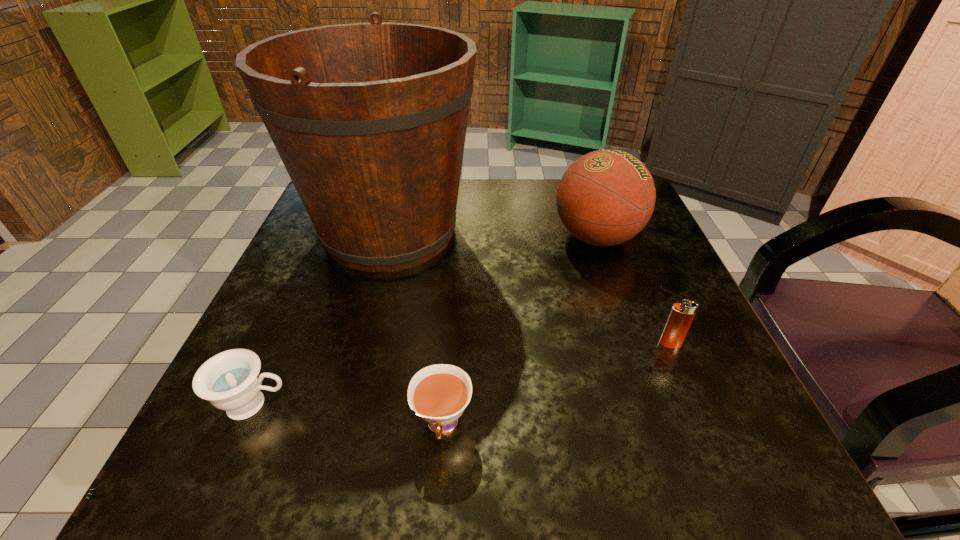
The image size is (960, 540). I want to click on the tallest object, so click(x=369, y=119).

Where is `basketball`? basketball is located at coordinates (606, 197).

The width and height of the screenshot is (960, 540). I want to click on igniter, so click(682, 314).

Find the location of a particular element. The image size is (960, 540). the third shortest object is located at coordinates (682, 314).

This screenshot has height=540, width=960. What are the coordinates of `the left teacup` in the screenshot? It's located at click(231, 381).

Locate an element on the screen. The width and height of the screenshot is (960, 540). the right teacup is located at coordinates (439, 393).

Find the location of a particular element. This screenshot has height=540, width=960. vacant space located on the front of the second tallest object is located at coordinates (612, 283).

The width and height of the screenshot is (960, 540). I want to click on vacant region located 0.140m on the back of the igniter, so click(x=643, y=281).

Locate an element on the screen. The width and height of the screenshot is (960, 540). vacant space located on the side of the left teacup with the handle is located at coordinates (365, 405).

The width and height of the screenshot is (960, 540). Identify the location of bucket situated at the far edge. (369, 119).